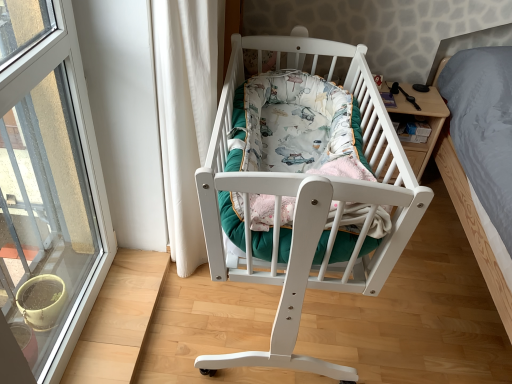
Question: From the image's perspective, is white wood crib at center over printed fabric mattress at center?

Choices:
 (A) no
 (B) yes

Answer: (A)

Question: From the image's perspective, is white wood crib at center below printed fabric mattress at center?

Choices:
 (A) no
 (B) yes

Answer: (B)

Question: Does white wood crib at center appear on the left side of printed fabric mattress at center?

Choices:
 (A) yes
 (B) no

Answer: (B)

Question: Can you confirm if white wood crib at center is taller than printed fabric mattress at center?

Choices:
 (A) yes
 (B) no

Answer: (B)

Question: From a real-world perspective, is white wood crib at center physically above printed fabric mattress at center?

Choices:
 (A) yes
 (B) no

Answer: (B)

Question: From a real-world perspective, is transparent glass window at left above or below printed fabric mattress at center?

Choices:
 (A) below
 (B) above

Answer: (A)

Question: Would you say transparent glass window at left is inside or outside printed fabric mattress at center?

Choices:
 (A) inside
 (B) outside

Answer: (B)

Question: Is transparent glass window at left bigger or smaller than printed fabric mattress at center?

Choices:
 (A) big
 (B) small

Answer: (A)

Question: From the image's perspective, is transparent glass window at left above or below printed fabric mattress at center?

Choices:
 (A) below
 (B) above

Answer: (A)

Question: From a real-world perspective, is printed fabric mattress at center physically located above or below wooden nightstand at right?

Choices:
 (A) above
 (B) below

Answer: (A)

Question: Visually, is printed fabric mattress at center positioned to the left or to the right of wooden nightstand at right?

Choices:
 (A) left
 (B) right

Answer: (A)

Question: Relative to wooden nightstand at right, is printed fabric mattress at center in front or behind?

Choices:
 (A) front
 (B) behind

Answer: (A)

Question: Is point (250, 210) closer or farther from the camera than point (411, 145)?

Choices:
 (A) farther
 (B) closer

Answer: (B)

Question: Looking at the image, does white wood crib at center seem bigger or smaller compared to printed fabric mattress at center?

Choices:
 (A) small
 (B) big

Answer: (B)

Question: From a real-world perspective, is white wood crib at center physically located above or below printed fabric mattress at center?

Choices:
 (A) above
 (B) below

Answer: (B)